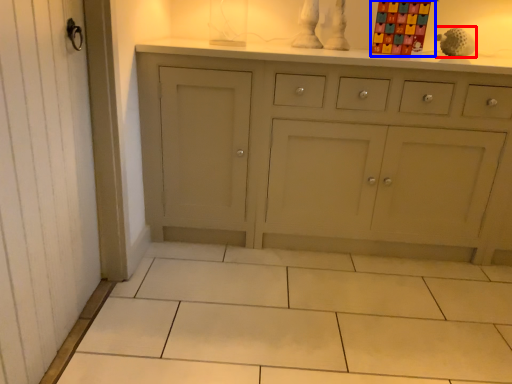
Question: Among these objects, which one is nearest to the camera, toy (highlighted by a red box) or toy (highlighted by a blue box)?

Choices:
 (A) toy
 (B) toy

Answer: (B)